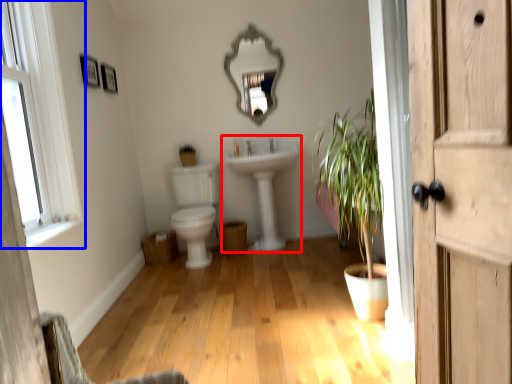
Question: Which of the following is the closest to the observer, sink (highlighted by a red box) or window (highlighted by a blue box)?

Choices:
 (A) sink
 (B) window

Answer: (B)